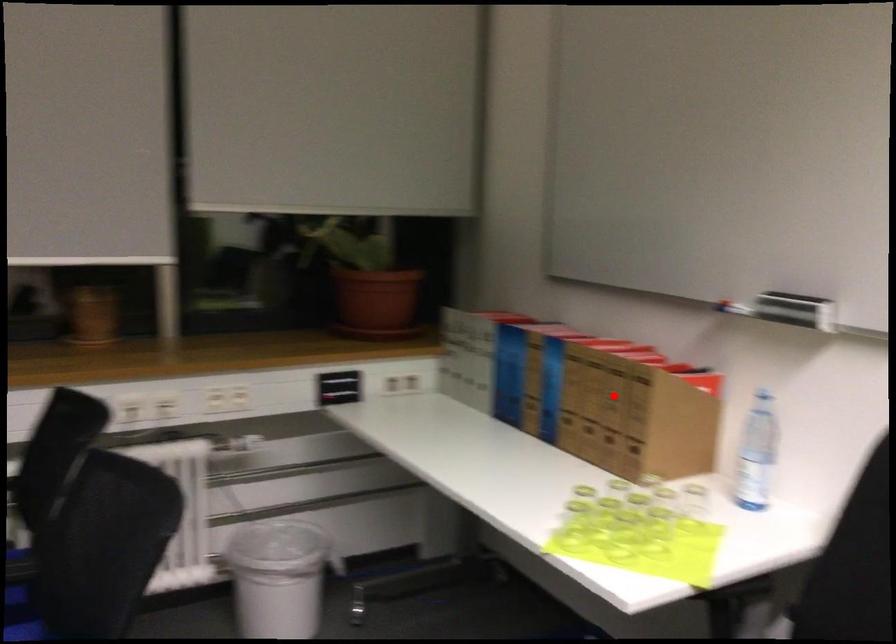
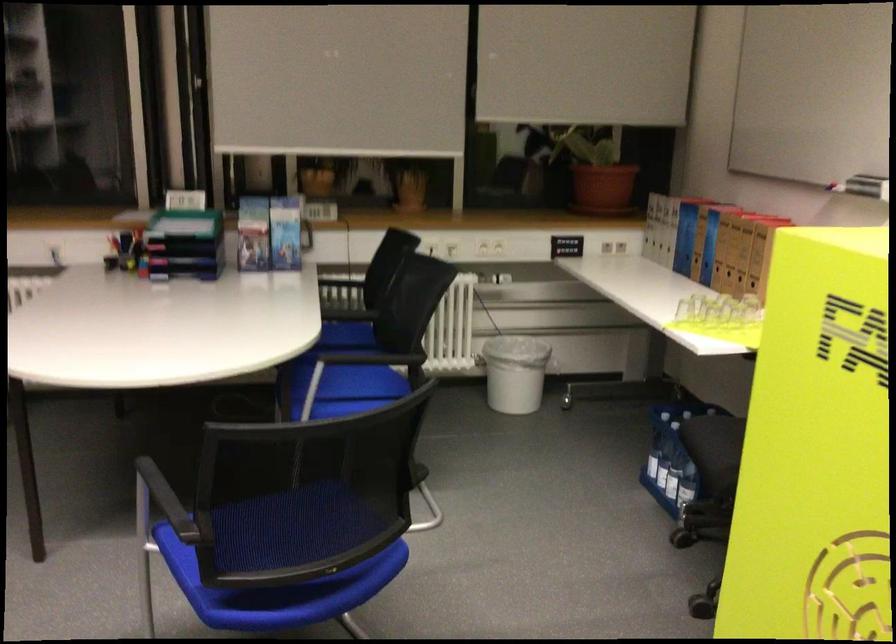
Locate, in the second image, the point that corresponds to the highlighted location in the first image.

(746, 243)